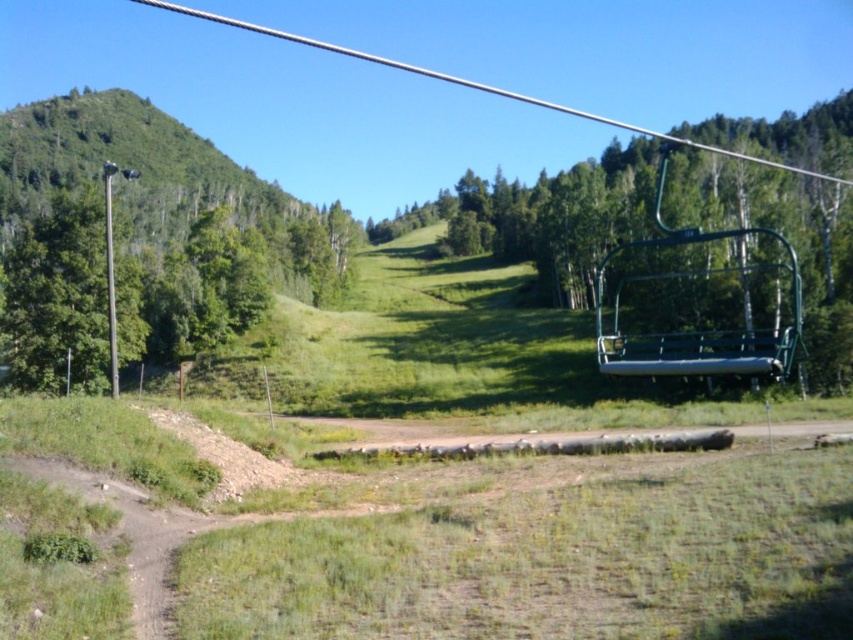
Is green metal chair at upper right positioned before metallic pole at left?

Yes, green metal chair at upper right is in front of metallic pole at left.

Which is behind, point (796, 244) or point (111, 390)?

Positioned behind is point (796, 244).

This screenshot has height=640, width=853. Identify the location of green metal chair at upper right. (677, 253).

Describe the element at coordinates (677, 253) in the screenshot. I see `green metal chair at upper right` at that location.

Is green metal chair at upper right shorter than green leafy tree at left?

No.

Who is more distant from viewer, (759, 292) or (84, 344)?

Point (84, 344)

At what (x,y) coordinates should I click in order to perform the action: click on green metal chair at upper right. Please return your answer as a coordinate pair (x, y). Image resolution: width=853 pixels, height=640 pixels. Looking at the image, I should click on (677, 253).

Is green leafy tree at left above metallic pole at left?

No, green leafy tree at left is not above metallic pole at left.

Where is `green leafy tree at left`? green leafy tree at left is located at coordinates (71, 298).